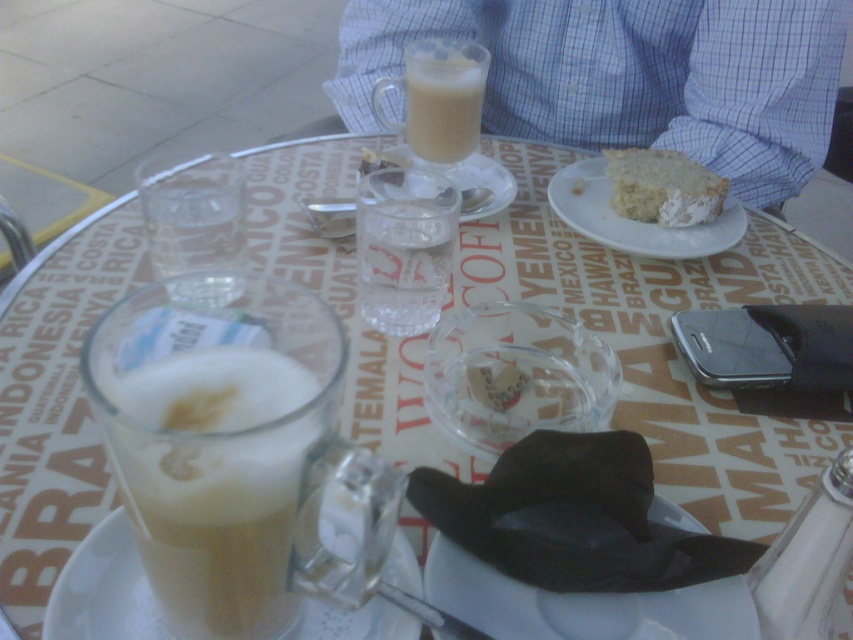
You are a customer at the outdoor table and want to place your phone on the table without blocking the white matte plate at center. Where should you place it?

The white matte plate at center is located at point (x=581, y=604), so you can place your phone elsewhere on the table to avoid blocking it.

You are a customer at the outdoor cafe and want to place your phone on the table without moving any items. The phone is 5 inches long. Can you fit it on the white matte plate at center?

The white matte plate at center is 11.71 inches away from camera, so the phone which is 5 inches long can fit on the white matte plate at center since its length is shorter than the plate.